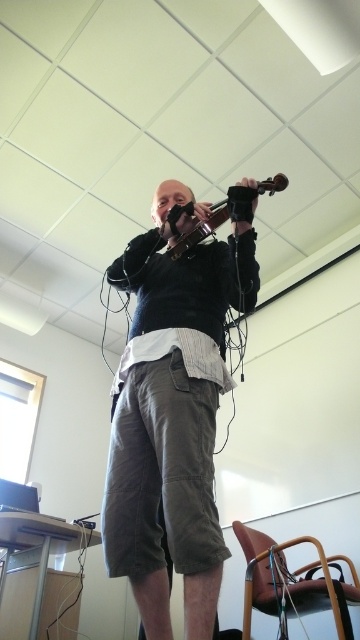
In the scene shown: Does dark gray cotton shorts at center appear under wooden violin at upper center?

Correct, dark gray cotton shorts at center is located below wooden violin at upper center.

Is the position of dark gray cotton shorts at center less distant than that of wooden violin at upper center?

Yes, dark gray cotton shorts at center is closer to the viewer.

Does point (120, 456) come farther from viewer compared to point (212, 212)?

No.

At what (x,y) coordinates should I click in order to perform the action: click on dark gray cotton shorts at center. Please return your answer as a coordinate pair (x, y). This screenshot has height=640, width=360. Looking at the image, I should click on (172, 419).